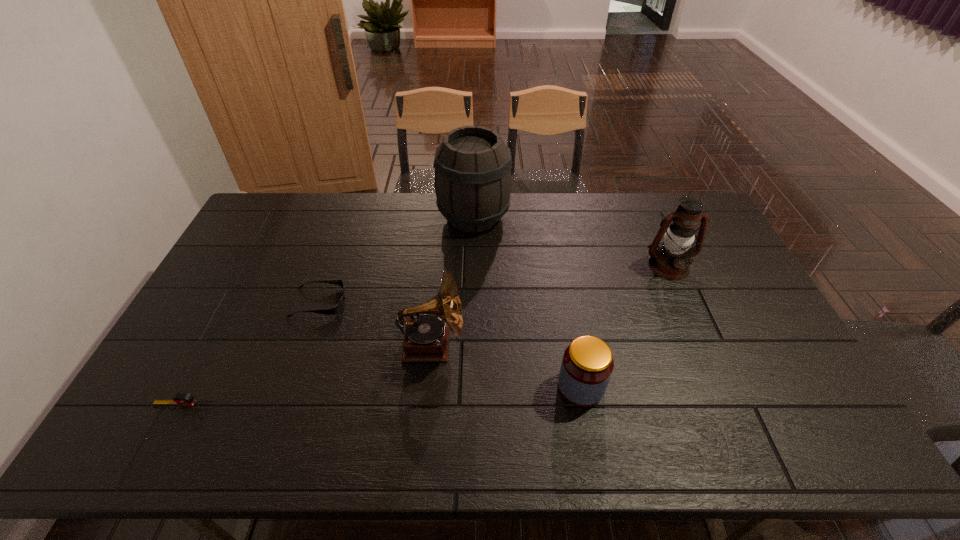
Image resolution: width=960 pixels, height=540 pixels. Find the location of `free space that satisfies the following two spatial constraints: 1. on the side of the rightmost object, there is a wick adjustment knob; 2. on the horn of the third tallest object`. free space that satisfies the following two spatial constraints: 1. on the side of the rightmost object, there is a wick adjustment knob; 2. on the horn of the third tallest object is located at coordinates (703, 344).

Locate an element on the screen. free point that satisfies the following two spatial constraints: 1. on the back side of the fifth object from left to right; 2. on the horn of the phonograph_record is located at coordinates (573, 344).

Where is `vacant region that satisfies the following two spatial constraints: 1. on the horn of the jar; 2. on the right side of the phonograph_record`? vacant region that satisfies the following two spatial constraints: 1. on the horn of the jar; 2. on the right side of the phonograph_record is located at coordinates (427, 387).

Where is `vacant area in the image that satisfies the following two spatial constraints: 1. on the side of the lantern, there is a wick adjustment knob; 2. on the front-facing side of the second object from left to right`? vacant area in the image that satisfies the following two spatial constraints: 1. on the side of the lantern, there is a wick adjustment knob; 2. on the front-facing side of the second object from left to right is located at coordinates (684, 302).